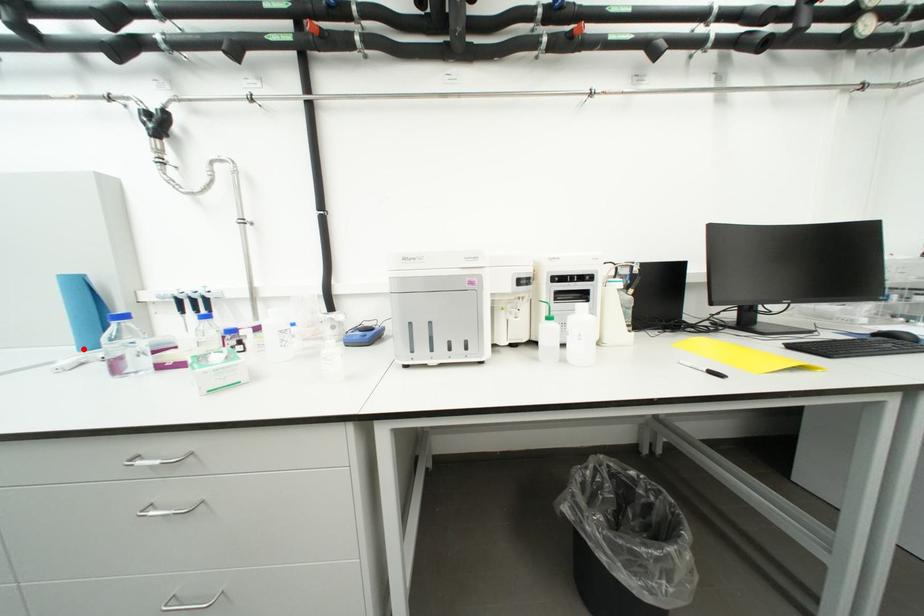
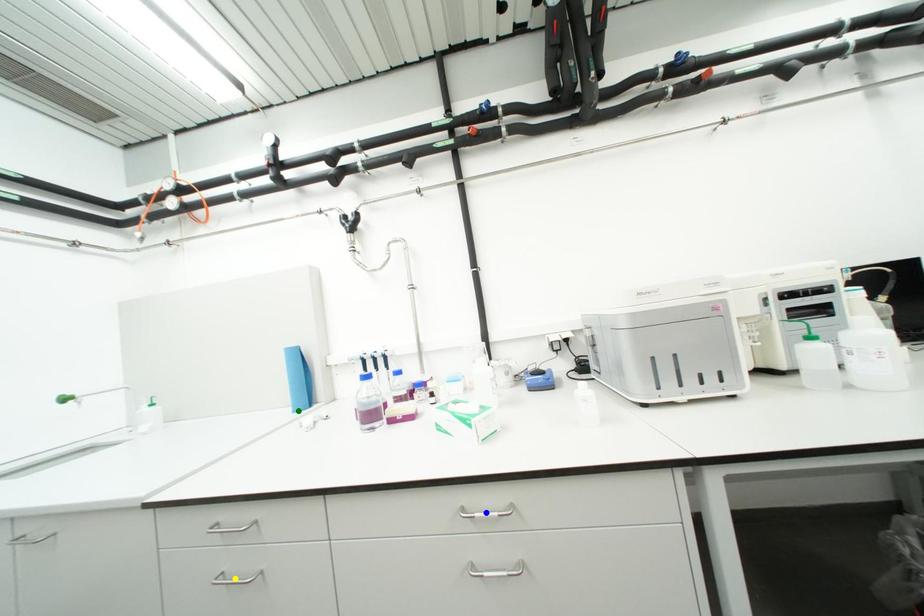
Question: I am providing you with two images of the same scene from different viewpoints. A red point is marked on the first image. You are given multiple points on the second image. Can you choose the point in image 2 that corresponds to the point in image 1?

Choices:
 (A) green point
 (B) blue point
 (C) yellow point

Answer: (A)